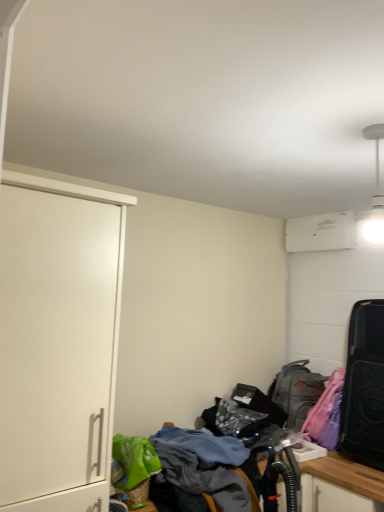
In order to click on textured fabric desk at lower center in this screenshot , I will do [343, 482].

Describe the element at coordinates (343, 482) in the screenshot. This screenshot has height=512, width=384. I see `textured fabric desk at lower center` at that location.

This screenshot has width=384, height=512. What do you see at coordinates (58, 341) in the screenshot?
I see `white matte cabinet at left` at bounding box center [58, 341].

Image resolution: width=384 pixels, height=512 pixels. What do you see at coordinates (296, 392) in the screenshot?
I see `gray fabric backpack at lower right` at bounding box center [296, 392].

Where is `textured fabric desk at lower center`? textured fabric desk at lower center is located at coordinates (343, 482).

Is textured fabric desk at lower center in front of or behind white matte cabinet at left in the image?

textured fabric desk at lower center is positioned closer to the viewer than white matte cabinet at left.

Does point (333, 463) appear closer or farther from the camera than point (54, 499)?

Point (333, 463) appears to be farther away from the viewer than point (54, 499).

Can you confirm if textured fabric desk at lower center is thinner than white matte cabinet at left?

Incorrect, the width of textured fabric desk at lower center is not less than that of white matte cabinet at left.

From the image's perspective, is textured fabric desk at lower center over white matte cabinet at left?

No, from the image's perspective, textured fabric desk at lower center is not on top of white matte cabinet at left.

Which is more to the right, gray fabric backpack at lower right or textured fabric desk at lower center?

From the viewer's perspective, gray fabric backpack at lower right appears more on the right side.

Which of these two, gray fabric backpack at lower right or textured fabric desk at lower center, is wider?

textured fabric desk at lower center is wider.

Can you confirm if gray fabric backpack at lower right is bigger than textured fabric desk at lower center?

No, gray fabric backpack at lower right is not bigger than textured fabric desk at lower center.

Is gray fabric backpack at lower right beside textured fabric desk at lower center?

gray fabric backpack at lower right is not next to textured fabric desk at lower center, and they're not touching.

Find the location of a particular element. The image size is (384, 512). desk on the right of white matte cabinet at left is located at coordinates (343, 482).

Which of these two, white matte cabinet at left or textured fabric desk at lower center, is bigger?

Bigger between the two is textured fabric desk at lower center.

From a real-world perspective, does white matte cabinet at left stand above textured fabric desk at lower center?

A: Yes, from a real-world perspective, white matte cabinet at left is on top of textured fabric desk at lower center.

Is point (112, 414) closer to viewer compared to point (326, 468)?

Yes.

Is black matte suitcase at right aimed at gray fabric backpack at lower right?

No, black matte suitcase at right does not turn towards gray fabric backpack at lower right.

Consider the image. Would you say black matte suitcase at right is outside gray fabric backpack at lower right?

black matte suitcase at right is positioned outside gray fabric backpack at lower right.

Does point (379, 466) come farther from viewer compared to point (303, 405)?

No, (379, 466) is closer to viewer.

Which is more to the left, black matte suitcase at right or gray fabric backpack at lower right?

gray fabric backpack at lower right.

Is point (16, 393) less distant than point (296, 423)?

Yes.

Is white matte cabinet at left far away from gray fabric backpack at lower right?

That's right, there is a large distance between white matte cabinet at left and gray fabric backpack at lower right.

From the image's perspective, is white matte cabinet at left located beneath gray fabric backpack at lower right?

No, from the image's perspective, white matte cabinet at left is not below gray fabric backpack at lower right.

Is white matte cabinet at left thinner than gray fabric backpack at lower right?

Incorrect, the width of white matte cabinet at left is not less than that of gray fabric backpack at lower right.

From the image's perspective, which one is positioned lower, black matte suitcase at right or textured fabric desk at lower center?

textured fabric desk at lower center is shown below in the image.

Can you tell me how much black matte suitcase at right and textured fabric desk at lower center differ in facing direction?

→ 4.23 degrees.

From a real-world perspective, does black matte suitcase at right stand above textured fabric desk at lower center?

Correct, in the physical world, black matte suitcase at right is higher than textured fabric desk at lower center.

Where is `luggage and bags beneath the white matte cabinet at left (from a real-world perspective)`? This screenshot has width=384, height=512. luggage and bags beneath the white matte cabinet at left (from a real-world perspective) is located at coordinates (364, 386).

Considering the relative sizes of black matte suitcase at right and white matte cabinet at left in the image provided, is black matte suitcase at right smaller than white matte cabinet at left?

Indeed, black matte suitcase at right has a smaller size compared to white matte cabinet at left.

Is point (373, 366) positioned after point (79, 431)?

That is True.

Where is `cabinetry on the left of textured fabric desk at lower center`? cabinetry on the left of textured fabric desk at lower center is located at coordinates (58, 341).

Locate an element on the screen. This screenshot has height=512, width=384. backpack lying above the textured fabric desk at lower center (from the image's perspective) is located at coordinates (296, 392).

Which object lies nearer to the anchor point gray fabric backpack at lower right, black matte suitcase at right or textured fabric desk at lower center?

black matte suitcase at right is closer to gray fabric backpack at lower right.

When comparing their distances from textured fabric desk at lower center, does gray fabric backpack at lower right or white matte cabinet at left seem further?

The object further to textured fabric desk at lower center is white matte cabinet at left.

From the image, which object appears to be nearer to gray fabric backpack at lower right, textured fabric desk at lower center or black matte suitcase at right?

Based on the image, black matte suitcase at right appears to be nearer to gray fabric backpack at lower right.

Estimate the real-world distances between objects in this image. Which object is closer to white matte cabinet at left, textured fabric desk at lower center or black matte suitcase at right?

The object closer to white matte cabinet at left is textured fabric desk at lower center.

Estimate the real-world distances between objects in this image. Which object is further from white matte cabinet at left, black matte suitcase at right or gray fabric backpack at lower right?

gray fabric backpack at lower right is positioned further to the anchor white matte cabinet at left.

Consider the image. Estimate the real-world distances between objects in this image. Which object is closer to black matte suitcase at right, white matte cabinet at left or gray fabric backpack at lower right?

gray fabric backpack at lower right is positioned closer to the anchor black matte suitcase at right.

Based on their spatial positions, is gray fabric backpack at lower right or textured fabric desk at lower center further from white matte cabinet at left?

→ The object further to white matte cabinet at left is gray fabric backpack at lower right.

Based on their spatial positions, is textured fabric desk at lower center or gray fabric backpack at lower right closer to black matte suitcase at right?

textured fabric desk at lower center.

In order to click on luggage and bags positioned between textured fabric desk at lower center and gray fabric backpack at lower right from near to far in this screenshot , I will do `click(364, 386)`.

In order to click on backpack between white matte cabinet at left and black matte suitcase at right in the horizontal direction in this screenshot , I will do `click(296, 392)`.

Where is `cabinetry located between textured fabric desk at lower center and gray fabric backpack at lower right in the depth direction`? This screenshot has width=384, height=512. cabinetry located between textured fabric desk at lower center and gray fabric backpack at lower right in the depth direction is located at coordinates (58, 341).

Where is `desk between white matte cabinet at left and black matte suitcase at right from left to right`? desk between white matte cabinet at left and black matte suitcase at right from left to right is located at coordinates (343, 482).